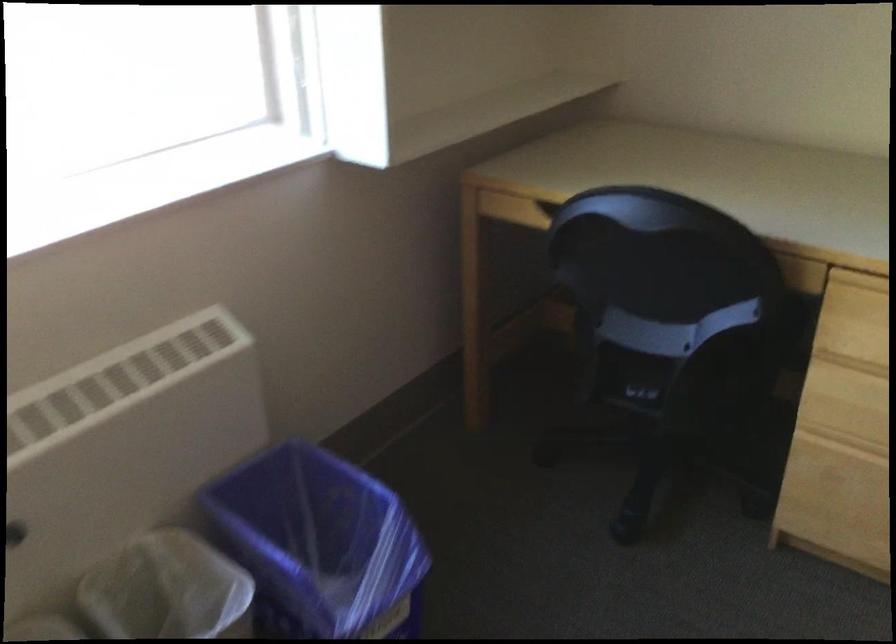
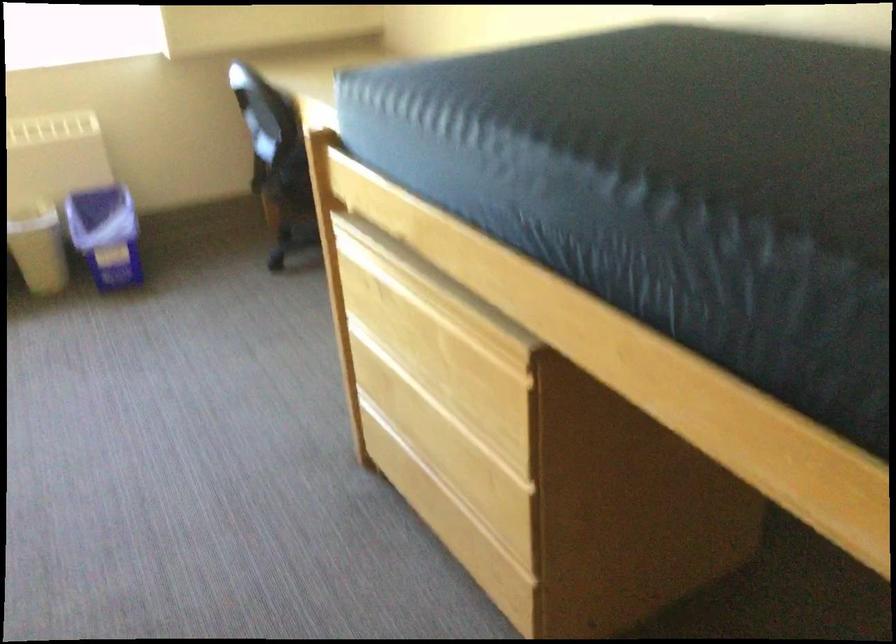
In a continuous first-person perspective shot, in which direction is the camera moving?

The cameraman walked toward right, backward.